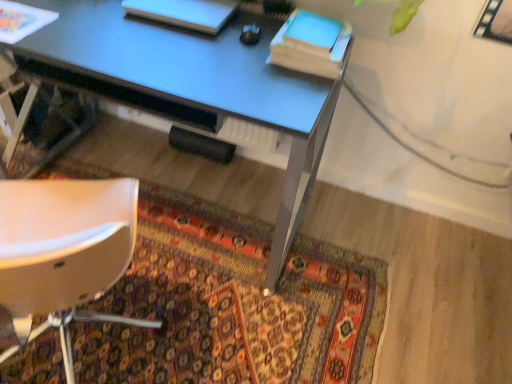
Identify the location of blank area beneath blue matte notepad at upper right (from a real-world perspective). The width and height of the screenshot is (512, 384). (316, 32).